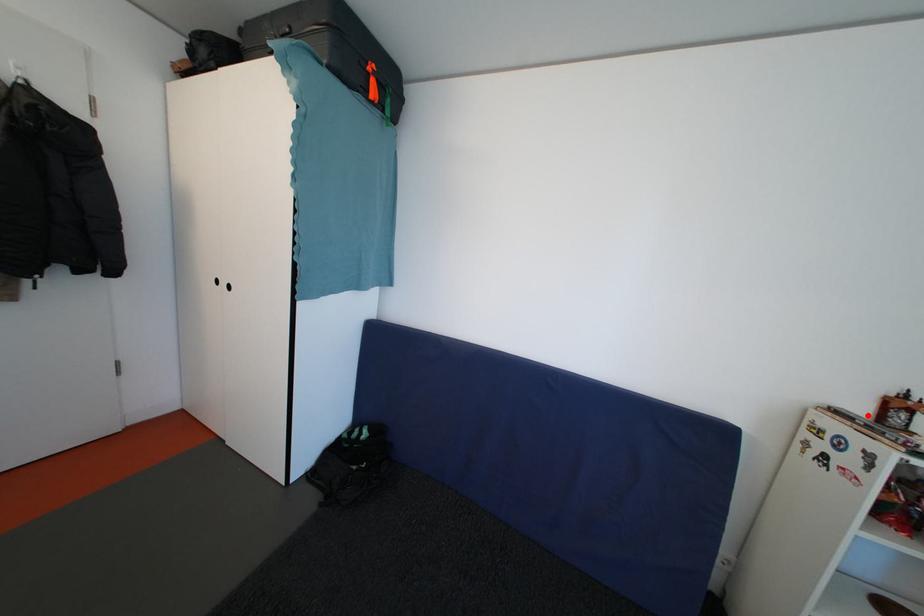
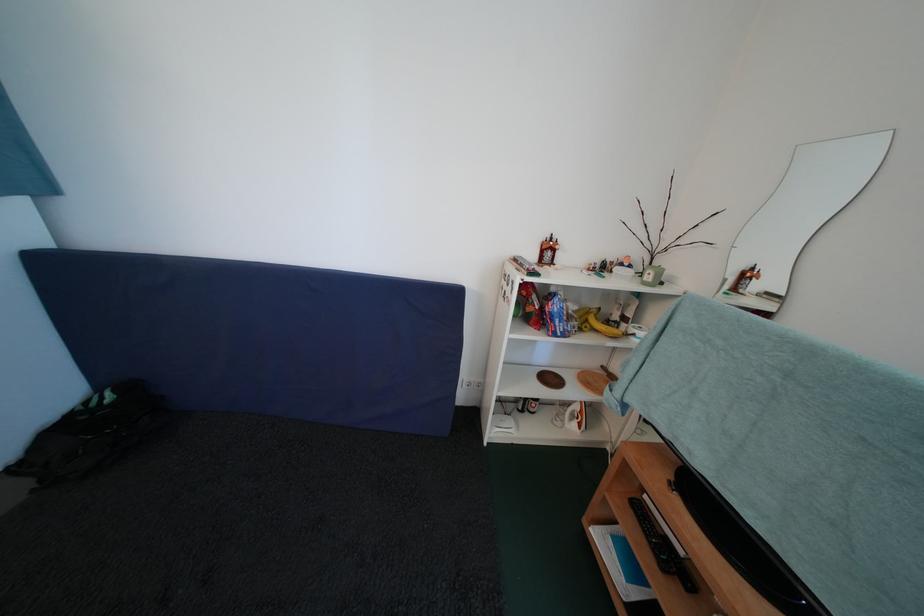
The point at the highlighted location is marked in the first image. Where is the corresponding point in the second image?

(539, 261)